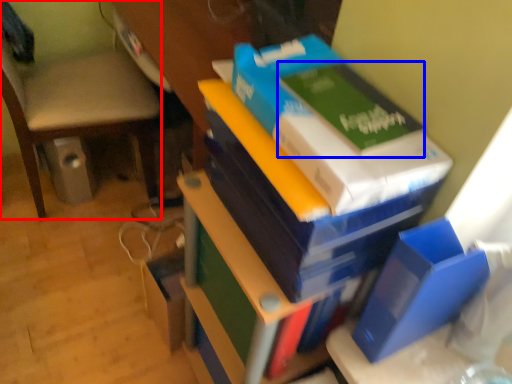
Question: Which of the following is the farthest to the observer, chair (highlighted by a red box) or paperback book (highlighted by a blue box)?

Choices:
 (A) chair
 (B) paperback book

Answer: (A)